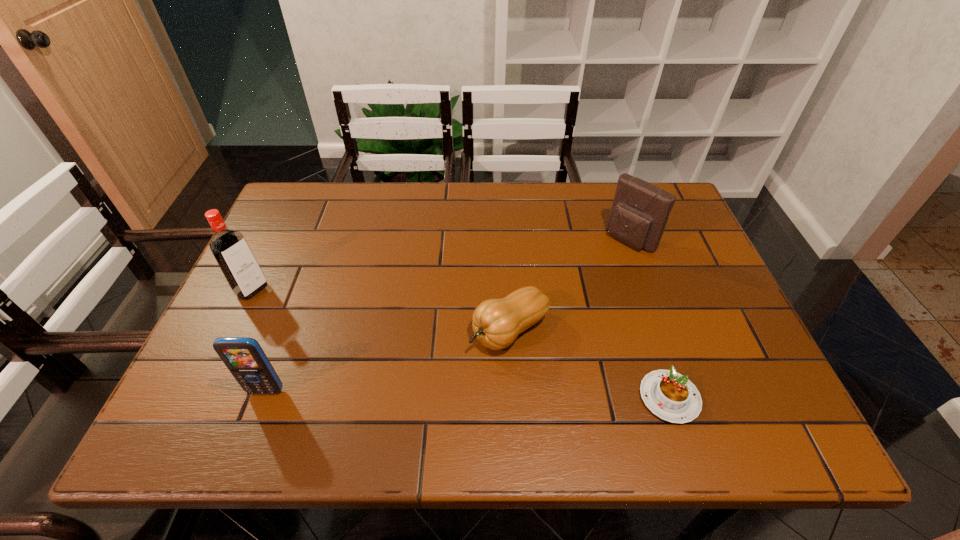
The image size is (960, 540). What are the coordinates of `the fourth object from right to left` in the screenshot? It's located at (245, 359).

The width and height of the screenshot is (960, 540). Find the location of `pudding`. pudding is located at coordinates (669, 395).

In order to click on the farthest object in this screenshot , I will do `click(640, 210)`.

I want to click on the tallest object, so click(230, 249).

This screenshot has height=540, width=960. I want to click on vodka, so click(x=230, y=249).

In order to click on the third farthest object in this screenshot , I will do `click(496, 323)`.

Locate an element on the screen. This screenshot has height=540, width=960. the second shortest object is located at coordinates (496, 323).

Where is `free space located 0.280m on the back of the pudding`? The width and height of the screenshot is (960, 540). free space located 0.280m on the back of the pudding is located at coordinates (630, 275).

Identify the location of vacant position located 0.130m with an open flap on the pouch. (589, 275).

You are a GUI agent. You are given a task and a screenshot of the screen. Output one action in this format:
    pyautogui.click(x=<x>, y=<y>)
    Task: Click on the vacant region located 0.220m with an open flap on the pouch
    This screenshot has height=540, width=960.
    Given the screenshot: What is the action you would take?
    pyautogui.click(x=568, y=294)